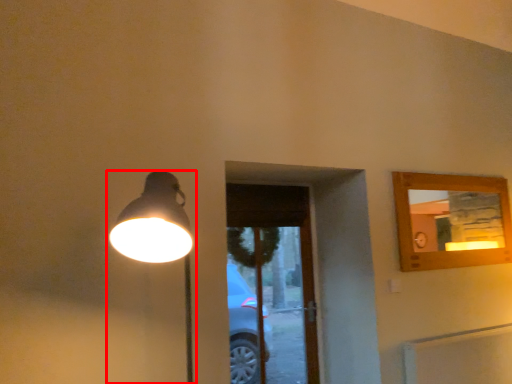
Question: From the image's perspective, considering the relative positions of lamp (annotated by the red box) and screen door in the image provided, where is lamp (annotated by the red box) located with respect to the staircase?

Choices:
 (A) above
 (B) below

Answer: (A)